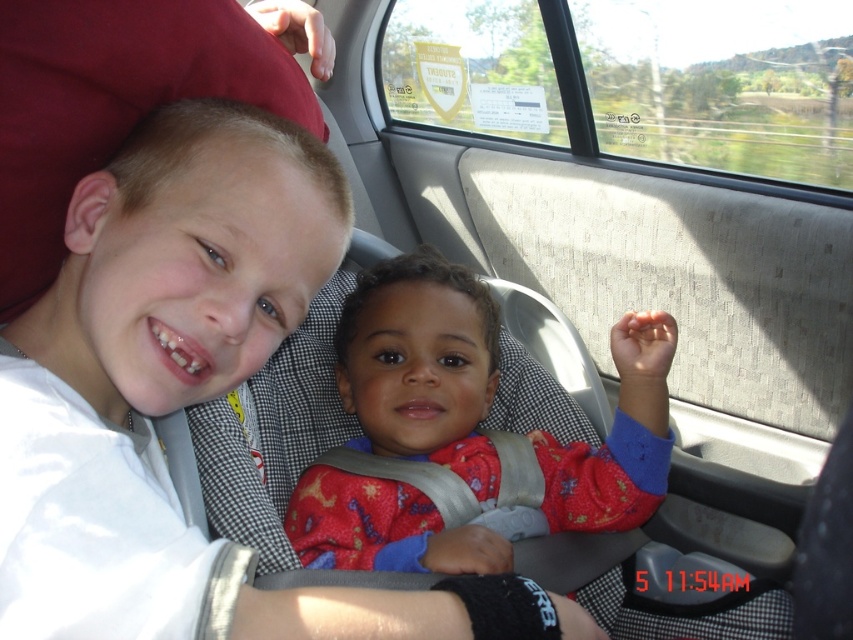
This screenshot has height=640, width=853. I want to click on red fabric baby car seat at center, so click(x=467, y=432).

You are a GUI agent. You are given a task and a screenshot of the screen. Output one action in this format:
    pyautogui.click(x=<x>, y=<y>)
    Task: Click on the red fabric baby car seat at center
    
    Given the screenshot: What is the action you would take?
    pyautogui.click(x=467, y=432)